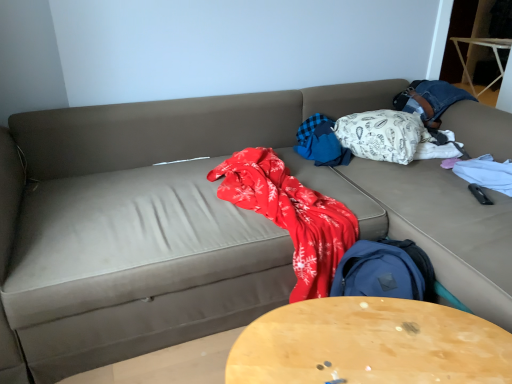
Question: Is wooden round table at center looking in the opposite direction of blue plaid blanket at center, arranged as the first blanket when viewed from the left?

Choices:
 (A) no
 (B) yes

Answer: (B)

Question: Considering the relative sizes of wooden round table at center and blue plaid blanket at center, which appears as the second blanket when viewed from the right, in the image provided, is wooden round table at center bigger than blue plaid blanket at center, which appears as the second blanket when viewed from the right,?

Choices:
 (A) no
 (B) yes

Answer: (B)

Question: From a real-world perspective, is wooden round table at center positioned over blue plaid blanket at center, arranged as the first blanket when viewed from the left, based on gravity?

Choices:
 (A) yes
 (B) no

Answer: (B)

Question: Is wooden round table at center to the left of blue plaid blanket at center, which appears as the second blanket when viewed from the right, from the viewer's perspective?

Choices:
 (A) no
 (B) yes

Answer: (B)

Question: Can you see wooden round table at center touching blue plaid blanket at center, arranged as the first blanket when viewed from the left?

Choices:
 (A) yes
 (B) no

Answer: (B)

Question: From the image's perspective, is white patterned fabric at upper right, acting as the second blanket starting from the left, above or below blue plaid blanket at center, which appears as the second blanket when viewed from the right?

Choices:
 (A) below
 (B) above

Answer: (B)

Question: Considering the positions of white patterned fabric at upper right, acting as the second blanket starting from the left, and blue plaid blanket at center, which appears as the second blanket when viewed from the right, in the image, is white patterned fabric at upper right, acting as the second blanket starting from the left, wider or thinner than blue plaid blanket at center, which appears as the second blanket when viewed from the right,?

Choices:
 (A) thin
 (B) wide

Answer: (B)

Question: Is white patterned fabric at upper right, acting as the second blanket starting from the left, bigger or smaller than blue plaid blanket at center, which appears as the second blanket when viewed from the right?

Choices:
 (A) big
 (B) small

Answer: (A)

Question: Relative to blue plaid blanket at center, which appears as the second blanket when viewed from the right, is white patterned fabric at upper right, the first blanket when ordered from right to left, in front or behind?

Choices:
 (A) behind
 (B) front

Answer: (B)

Question: From the image's perspective, is blue plaid blanket at center, which appears as the second blanket when viewed from the right, located above or below wooden round table at center?

Choices:
 (A) below
 (B) above

Answer: (B)

Question: Is point (324, 120) positioned closer to the camera than point (289, 304)?

Choices:
 (A) closer
 (B) farther

Answer: (B)

Question: In terms of height, does blue plaid blanket at center, which appears as the second blanket when viewed from the right, look taller or shorter compared to wooden round table at center?

Choices:
 (A) tall
 (B) short

Answer: (B)

Question: Is blue plaid blanket at center, which appears as the second blanket when viewed from the right, to the left or to the right of wooden round table at center in the image?

Choices:
 (A) right
 (B) left

Answer: (A)

Question: From the image's perspective, relative to wooden round table at center, is white patterned fabric at upper right, the first blanket when ordered from right to left, above or below?

Choices:
 (A) below
 (B) above

Answer: (B)

Question: Visually, is white patterned fabric at upper right, the first blanket when ordered from right to left, positioned to the left or to the right of wooden round table at center?

Choices:
 (A) right
 (B) left

Answer: (A)